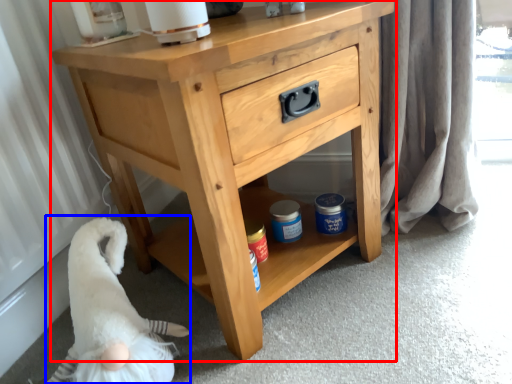
Question: Which object is closer to the camera taking this photo, chest of drawers (highlighted by a red box) or animal (highlighted by a blue box)?

Choices:
 (A) chest of drawers
 (B) animal

Answer: (A)